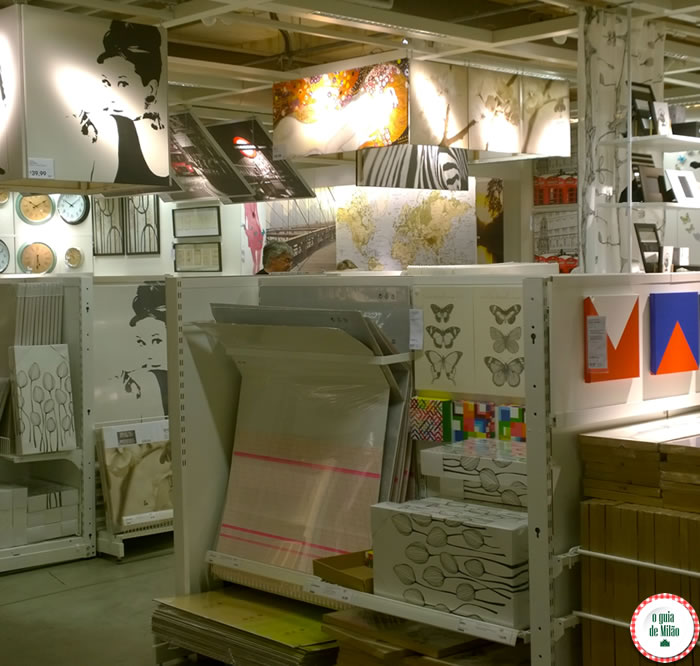
The image size is (700, 666). Find the location of `print of world map`. print of world map is located at coordinates (405, 234).